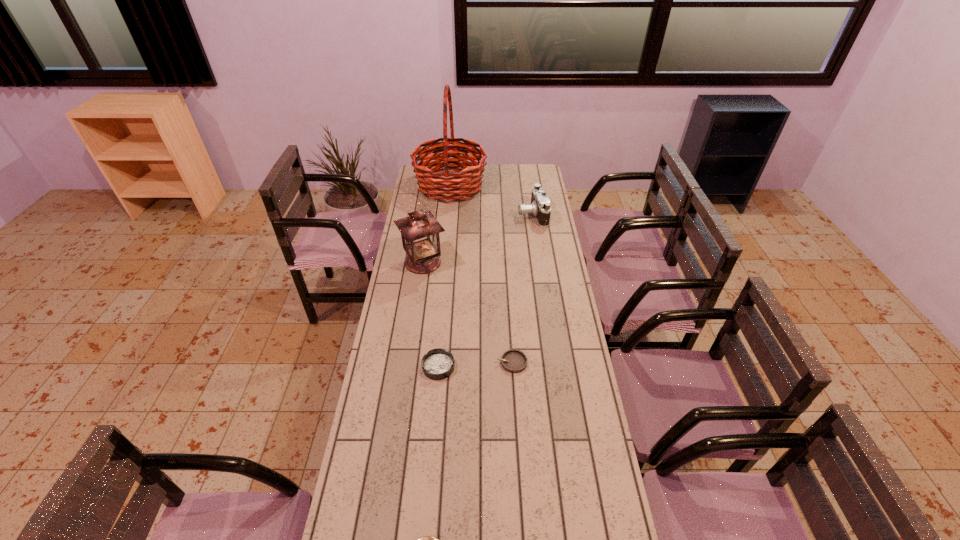
Image resolution: width=960 pixels, height=540 pixels. I want to click on unoccupied area between the rightmost ashtray and the basket, so click(481, 274).

The width and height of the screenshot is (960, 540). Find the location of `vacant area that lies between the fourth shortest object and the basket`. vacant area that lies between the fourth shortest object and the basket is located at coordinates (492, 200).

You are a GUI agent. You are given a task and a screenshot of the screen. Output one action in this format:
    pyautogui.click(x=<x>, y=<y>)
    Task: Click on the free spot between the camera and the basket
    This screenshot has width=960, height=540.
    Given the screenshot: What is the action you would take?
    pyautogui.click(x=492, y=200)

Select which object is the closest to the nearest object. Please provide its 2D coordinates. Your answer should be formatted as a tuple, i.e. [(x, y)], where the tuple contains the x and y coordinates of a point satisfying the conditions above.

[(437, 364)]

Identify which object is located as the third nearest to the nearest ashtray. Please provide its 2D coordinates. Your answer should be formatted as a tuple, i.e. [(x, y)], where the tuple contains the x and y coordinates of a point satisfying the conditions above.

[(420, 230)]

In order to click on ashtray that is the third closest one to the third tallest object in this screenshot , I will do `click(426, 539)`.

Locate which ashtray ranks third in proximity to the camera. Please provide its 2D coordinates. Your answer should be formatted as a tuple, i.e. [(x, y)], where the tuple contains the x and y coordinates of a point satisfying the conditions above.

[(426, 539)]

The height and width of the screenshot is (540, 960). Identify the location of vacant region that satisfies the following two spatial constraints: 1. on the handle side of the tallest object; 2. on the left side of the rightmost ashtray. (434, 362).

At what (x,y) coordinates should I click in order to perform the action: click on vacant area in the image that satisfies the following two spatial constraints: 1. at the lens of the rightmost object; 2. on the front side of the fifth object from left to right. Please return your answer as a coordinate pair (x, y). Looking at the image, I should click on (555, 362).

This screenshot has height=540, width=960. I want to click on free location that satisfies the following two spatial constraints: 1. on the handle side of the tallest object; 2. on the back side of the rightmost ashtray, so click(x=434, y=362).